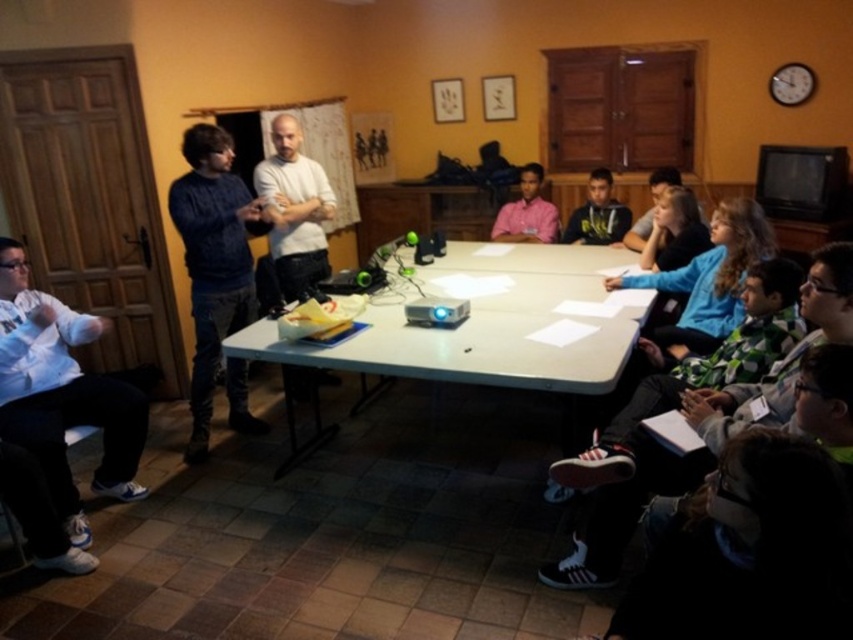
Question: From the image, what is the correct spatial relationship of white plastic table at center in relation to white cotton shirt at lower left?

Choices:
 (A) right
 (B) left

Answer: (A)

Question: Where is white plastic table at center located in relation to white cotton shirt at lower left in the image?

Choices:
 (A) right
 (B) left

Answer: (A)

Question: Can you confirm if white plastic table at center is wider than white cotton shirt at lower left?

Choices:
 (A) yes
 (B) no

Answer: (A)

Question: Which point is farther from the camera taking this photo?

Choices:
 (A) click(x=508, y=288)
 (B) click(x=16, y=244)

Answer: (A)